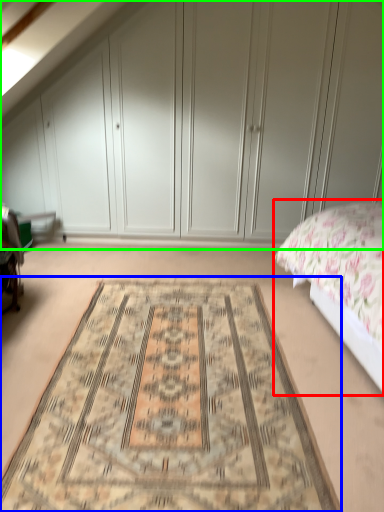
Question: Which object is positioned closest to bed (highlighted by a red box)? Select from mat (highlighted by a blue box) and dresser (highlighted by a green box).

Choices:
 (A) mat
 (B) dresser

Answer: (A)